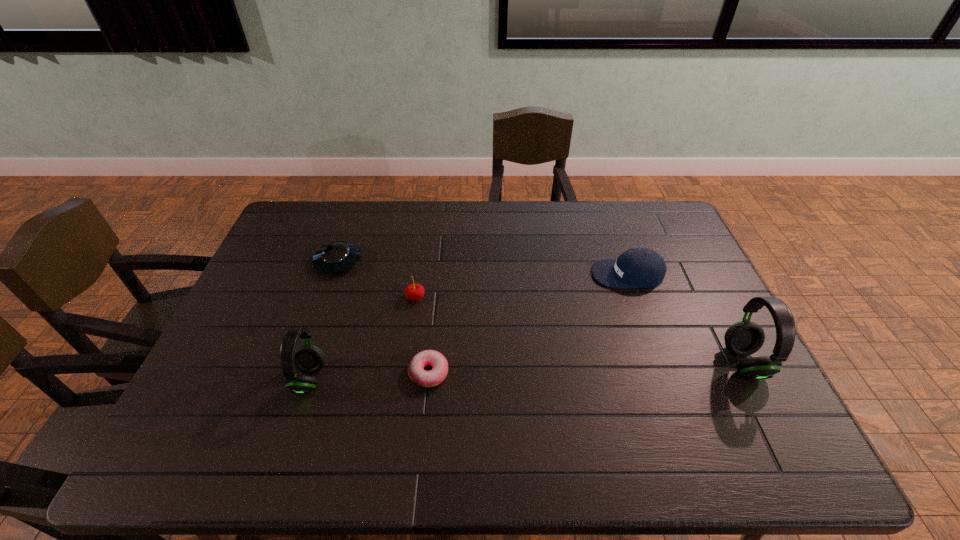
Locate an element on the screen. This screenshot has width=960, height=540. vacant area between the fifth tallest object and the baseball cap is located at coordinates (483, 268).

Locate an element on the screen. The width and height of the screenshot is (960, 540). vacant area between the fourth nearest object and the saucer is located at coordinates (377, 280).

Identify the location of vacant space that's between the right headset and the doughnut. Image resolution: width=960 pixels, height=540 pixels. pos(587,367).

Find the location of `free space between the right headset and the fifth tallest object`. free space between the right headset and the fifth tallest object is located at coordinates (541, 312).

The image size is (960, 540). I want to click on empty space that is in between the right headset and the cherry, so click(580, 330).

Identify the location of empty location between the cherry and the saucer. (377, 280).

The height and width of the screenshot is (540, 960). What are the coordinates of `empty space between the fourth nearest object and the second object from right to left` in the screenshot? It's located at (521, 286).

This screenshot has height=540, width=960. In order to click on vacant region between the second shortest object and the doughnut in this screenshot , I will do `click(383, 317)`.

At what (x,y) coordinates should I click in order to perform the action: click on vacant area that lies between the fourth nearest object and the fourth tallest object. Please return your answer as a coordinate pair (x, y). The height and width of the screenshot is (540, 960). Looking at the image, I should click on (521, 286).

The height and width of the screenshot is (540, 960). I want to click on free space between the cherry and the baseball cap, so click(x=521, y=286).